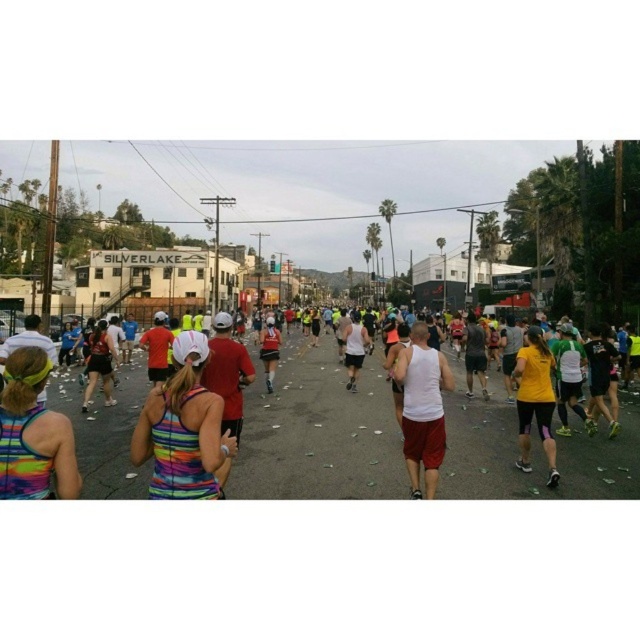
Which is more to the left, multicolored tank top at center or white matte tank top at center?

From the viewer's perspective, multicolored tank top at center appears more on the left side.

What do you see at coordinates (317, 433) in the screenshot? The image size is (640, 640). I see `multicolored tank top at center` at bounding box center [317, 433].

Describe the element at coordinates (317, 433) in the screenshot. I see `multicolored tank top at center` at that location.

You are a GUI agent. You are given a task and a screenshot of the screen. Output one action in this format:
    pyautogui.click(x=<x>, y=<y>)
    Task: Click on the multicolored tank top at center
    The width and height of the screenshot is (640, 640).
    Given the screenshot: What is the action you would take?
    pyautogui.click(x=317, y=433)

Is multicolored tank top at center to the right of yellow fabric at right from the viewer's perspective?

Incorrect, multicolored tank top at center is not on the right side of yellow fabric at right.

Between point (332, 378) and point (540, 356), which one is positioned in front?

Point (540, 356) is more forward.

Which is in front, point (68, 378) or point (525, 456)?

Point (525, 456) is in front.

The width and height of the screenshot is (640, 640). I want to click on multicolored tank top at center, so click(x=317, y=433).

How much distance is there between multicolored fabric tank top at center and yellow fabric at right?

multicolored fabric tank top at center is 6.31 meters from yellow fabric at right.

Can you confirm if multicolored fabric tank top at center is smaller than yellow fabric at right?

Actually, multicolored fabric tank top at center might be larger than yellow fabric at right.

Identify the location of multicolored fabric tank top at center. This screenshot has width=640, height=640. (182, 429).

This screenshot has height=640, width=640. In order to click on multicolored fabric tank top at center in this screenshot , I will do `click(182, 429)`.